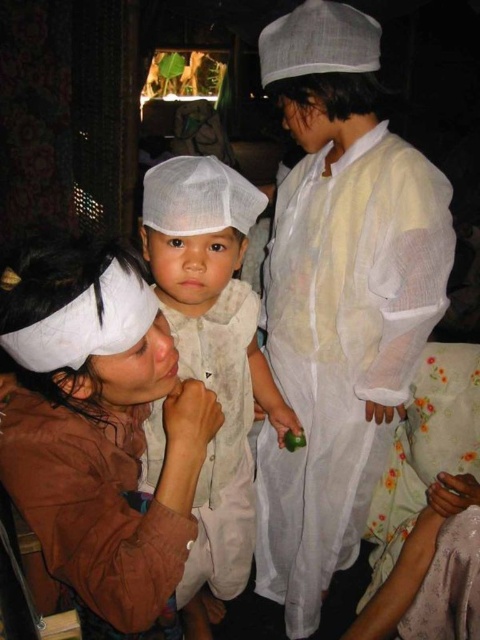
Question: Which of these objects is positioned farthest from the brown suede jacket at lower left?

Choices:
 (A) white cotton hat at center
 (B) white sheer robe at center

Answer: (B)

Question: Does white sheer robe at center have a greater width compared to white cotton hat at center?

Choices:
 (A) yes
 (B) no

Answer: (A)

Question: Can you confirm if brown suede jacket at lower left is smaller than white cotton hat at center?

Choices:
 (A) no
 (B) yes

Answer: (B)

Question: Where is brown suede jacket at lower left located in relation to white cotton hat at center in the image?

Choices:
 (A) left
 (B) right

Answer: (A)

Question: Based on their relative distances, which object is nearer to the white cotton hat at center?

Choices:
 (A) brown suede jacket at lower left
 (B) white sheer robe at center

Answer: (B)

Question: Estimate the real-world distances between objects in this image. Which object is farther from the brown suede jacket at lower left?

Choices:
 (A) white cotton hat at center
 (B) white sheer robe at center

Answer: (B)